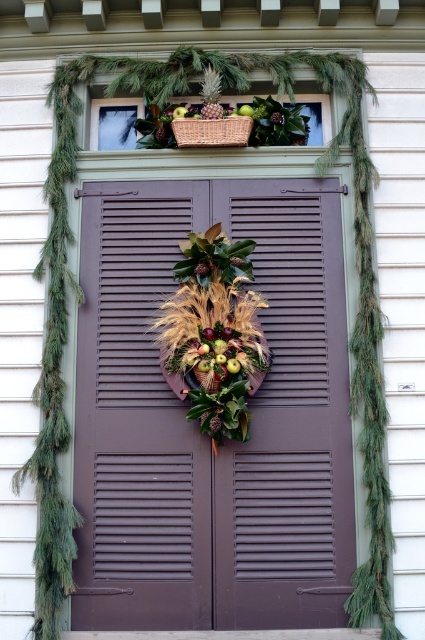
You are standing at point (104, 563) and want to reach the front door. The door is 14.49 feet away. Can you walk straight to the door without any obstacles?

Yes, you can walk straight to the door because there are no obstacles mentioned between point (104, 563) and the front door, and the distance is 14.49 feet.

You are standing in front of the front door and want to hang a new decoration. There are two points marked on the door at coordinates point (178, 129) and point (271, 115). Which point is closer to the viewer?

Point (178, 129) is in front of point (271, 115), so it is closer to the viewer.